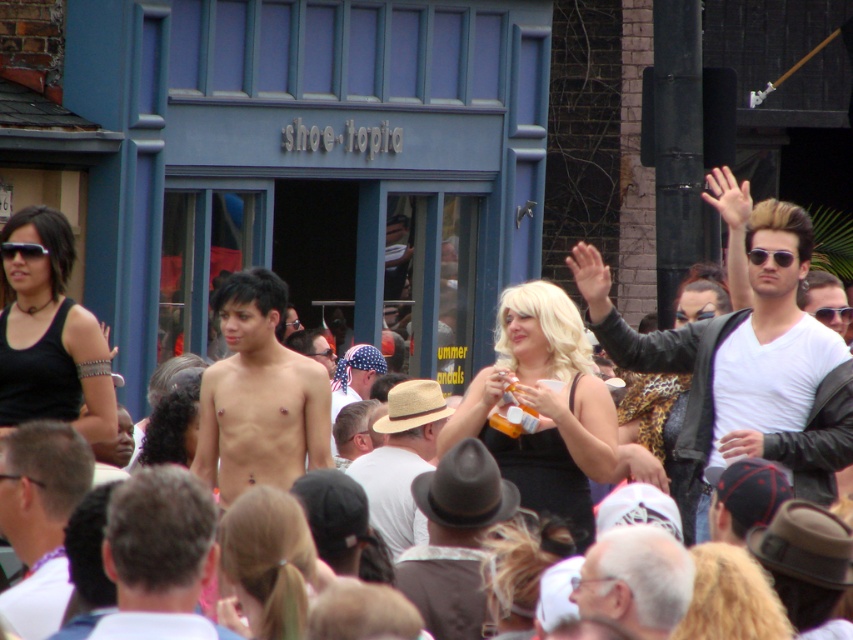
Question: Can you confirm if straw hat at center is positioned below white matte shirt at upper right?

Choices:
 (A) yes
 (B) no

Answer: (A)

Question: Which point appears farthest from the camera in this image?

Choices:
 (A) (761, 435)
 (B) (164, 445)
 (C) (392, 440)
 (D) (68, 225)

Answer: (C)

Question: Which point is farther to the camera?

Choices:
 (A) (158, 605)
 (B) (376, 465)
 (C) (231, 538)
 (D) (96, 348)

Answer: (B)

Question: Is nude torso at center bigger than blonde hair at center?

Choices:
 (A) yes
 (B) no

Answer: (A)

Question: Can you confirm if white fabric shirt at lower left is smaller than white matte shirt at upper right?

Choices:
 (A) no
 (B) yes

Answer: (A)

Question: Which point is farther to the camera?

Choices:
 (A) (151, 444)
 (B) (231, 532)
 (C) (200, 417)
 (D) (408, 406)

Answer: (D)